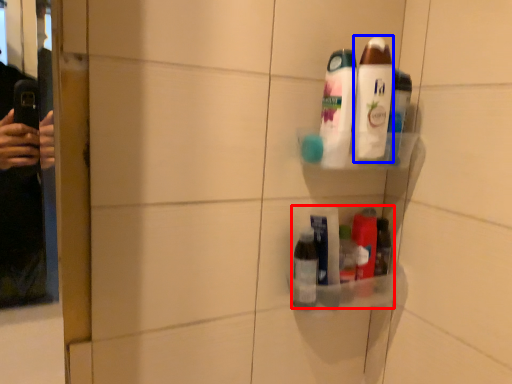
Question: Which of the following is the closest to the observer, product (highlighted by a red box) or toiletry (highlighted by a blue box)?

Choices:
 (A) product
 (B) toiletry

Answer: (B)